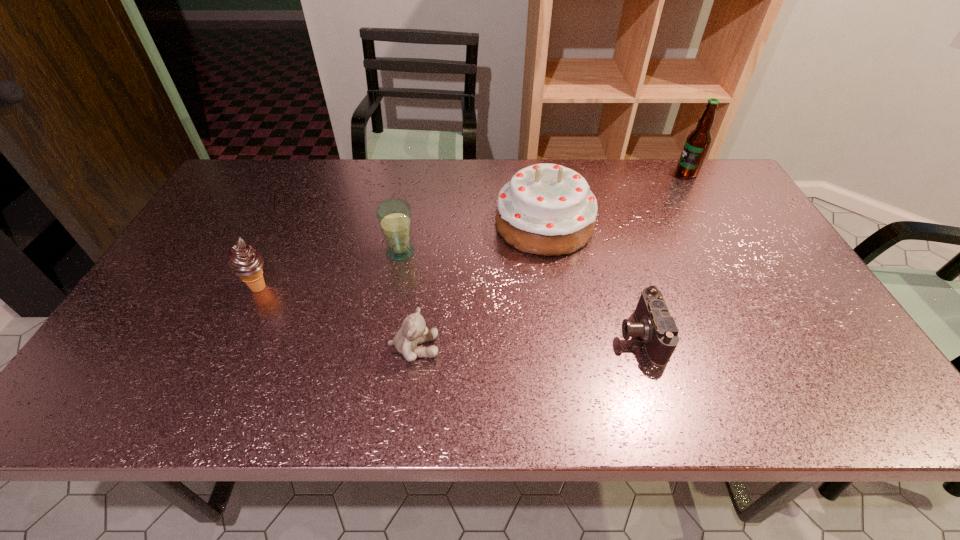
The height and width of the screenshot is (540, 960). I want to click on the farthest object, so click(x=698, y=141).

This screenshot has width=960, height=540. I want to click on the tallest object, so click(x=698, y=141).

Identify the location of cake. This screenshot has width=960, height=540. (546, 209).

At what (x,y) coordinates should I click in order to perform the action: click on icecream. Please return your answer as a coordinate pair (x, y). The height and width of the screenshot is (540, 960). Looking at the image, I should click on (245, 262).

Where is `the leftmost object`? the leftmost object is located at coordinates (245, 262).

At what (x,y) coordinates should I click in order to perform the action: click on glass. Please return your answer as a coordinate pair (x, y). Looking at the image, I should click on (394, 215).

Identify the location of the fifth tallest object. (413, 331).

What are the coordinates of `camera` in the screenshot? It's located at (655, 326).

I want to click on vacant space situated 0.230m on the label of the beer bottle, so click(x=607, y=173).

The image size is (960, 540). What are the coordinates of `vacant space located 0.110m on the label of the beer bottle` in the screenshot? It's located at (642, 173).